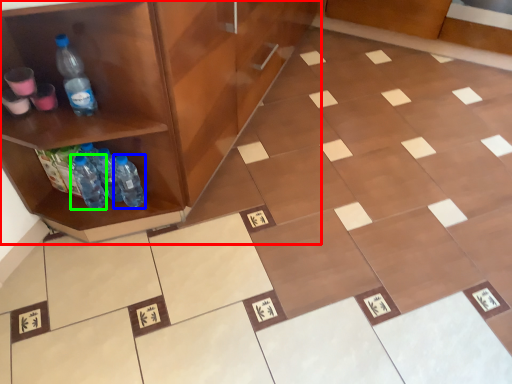
Question: Based on their relative distances, which object is nearer to cabinetry (highlighted by a red box)? Choose from bottle (highlighted by a blue box) and bottle (highlighted by a green box).

Choices:
 (A) bottle
 (B) bottle

Answer: (A)